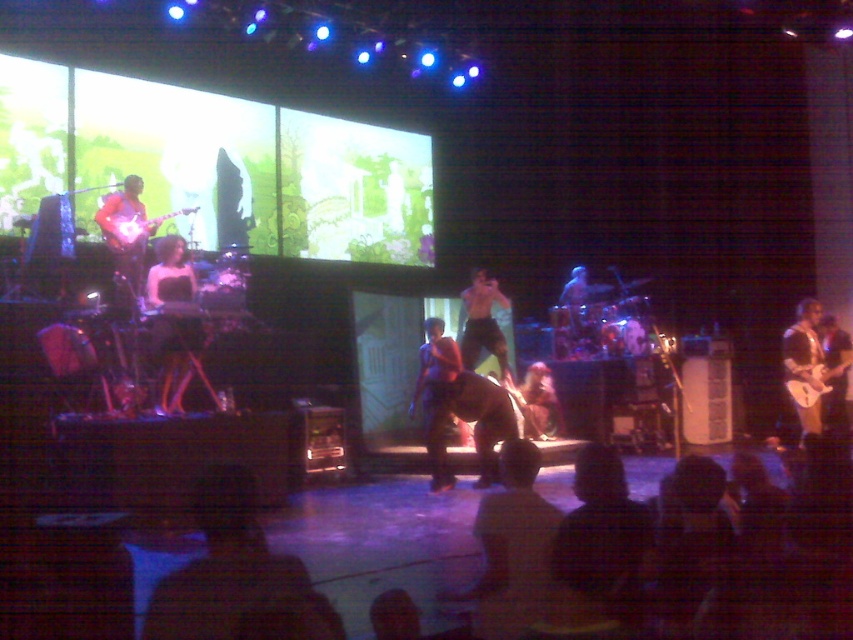
The image size is (853, 640). Find the location of `dark purple shirt at center`. dark purple shirt at center is located at coordinates (436, 396).

Can you confirm if dark purple shirt at center is smaller than shiny black shorts at center?

Correct, dark purple shirt at center occupies less space than shiny black shorts at center.

Describe the element at coordinates (436, 396) in the screenshot. The image size is (853, 640). I see `dark purple shirt at center` at that location.

Where is `dark purple shirt at center`? This screenshot has width=853, height=640. dark purple shirt at center is located at coordinates (436, 396).

Does matte black guitar at left appear on the left side of shiny black shorts at center?

Yes, matte black guitar at left is to the left of shiny black shorts at center.

Is matte black guitar at left smaller than shiny black shorts at center?

Yes, matte black guitar at left is smaller than shiny black shorts at center.

What do you see at coordinates (125, 240) in the screenshot? The width and height of the screenshot is (853, 640). I see `matte black guitar at left` at bounding box center [125, 240].

Where is `matte black guitar at left`? matte black guitar at left is located at coordinates (125, 240).

Based on the photo, does dark purple shirt at center appear under glossy brown guitar at right?

Correct, dark purple shirt at center is located below glossy brown guitar at right.

Does dark purple shirt at center come behind glossy brown guitar at right?

That is False.

Who is more forward, (438, 420) or (811, 424)?

Positioned in front is point (438, 420).

I want to click on dark purple shirt at center, so click(436, 396).